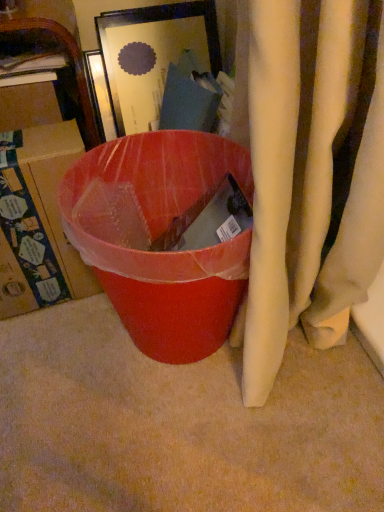
Question: Is matte cardboard box at left thinner than matte plastic trash can at center?

Choices:
 (A) yes
 (B) no

Answer: (A)

Question: Is matte cardboard box at left positioned before matte plastic trash can at center?

Choices:
 (A) no
 (B) yes

Answer: (A)

Question: Is matte cardboard box at left further to the viewer compared to matte plastic trash can at center?

Choices:
 (A) no
 (B) yes

Answer: (B)

Question: Is matte cardboard box at left turned away from matte plastic trash can at center?

Choices:
 (A) no
 (B) yes

Answer: (A)

Question: From the image's perspective, would you say matte cardboard box at left is shown under matte plastic trash can at center?

Choices:
 (A) yes
 (B) no

Answer: (B)

Question: Considering the relative sizes of matte cardboard box at left and matte plastic trash can at center in the image provided, is matte cardboard box at left shorter than matte plastic trash can at center?

Choices:
 (A) no
 (B) yes

Answer: (B)

Question: Does matte plastic trash can at center turn towards matte cardboard box at left?

Choices:
 (A) no
 (B) yes

Answer: (B)

Question: Is matte plastic trash can at center turned away from matte cardboard box at left?

Choices:
 (A) yes
 (B) no

Answer: (B)

Question: Is matte plastic trash can at center in contact with matte cardboard box at left?

Choices:
 (A) yes
 (B) no

Answer: (B)

Question: From a real-world perspective, does matte plastic trash can at center sit lower than matte cardboard box at left?

Choices:
 (A) no
 (B) yes

Answer: (B)

Question: Is matte plastic trash can at center shorter than matte cardboard box at left?

Choices:
 (A) yes
 (B) no

Answer: (B)

Question: Is matte plastic trash can at center positioned behind matte cardboard box at left?

Choices:
 (A) yes
 (B) no

Answer: (B)

Question: Considering their positions, is matte plastic trash can at center located in front of or behind matte cardboard box at left?

Choices:
 (A) front
 (B) behind

Answer: (A)